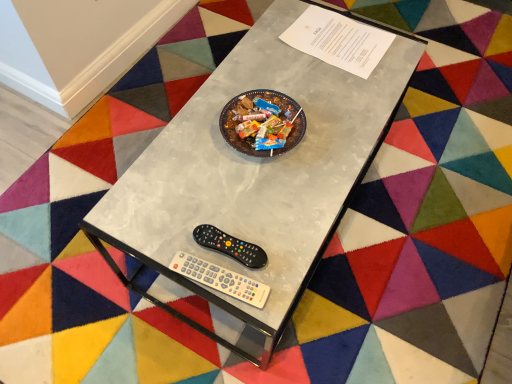
This screenshot has height=384, width=512. What are the coordinates of `vacant area on the back side of white plastic wii controller at lower center` in the screenshot? It's located at point(219,202).